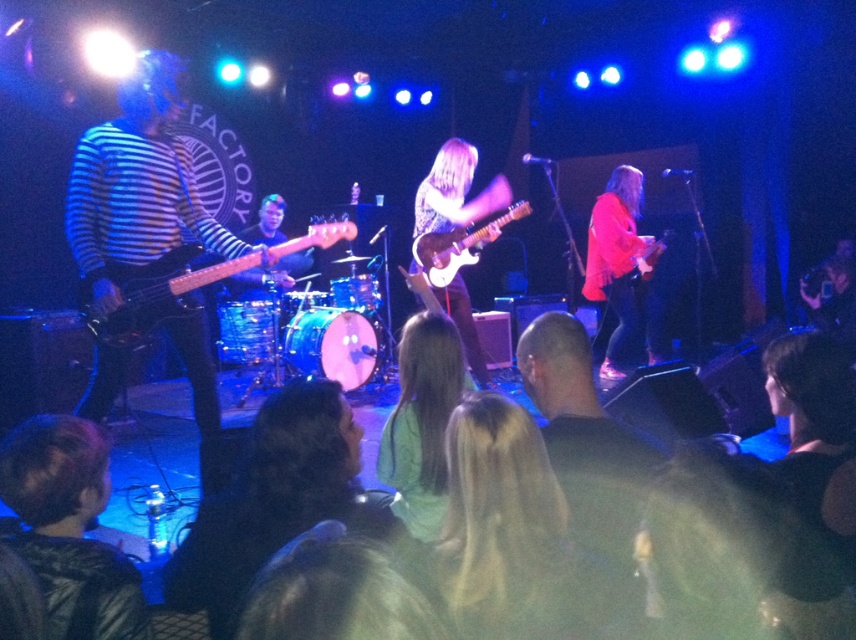
You are a photographer at The Factory venue. You want to take a photo of the two performers wearing the dark brown leather jacket at lower left and the light green fabric shirt at center. Which performer will appear larger in your photo?

The dark brown leather jacket at lower left is closer to the viewer than the light green fabric shirt at center, so the performer wearing the dark brown leather jacket at lower left will appear larger in the photo.

From the picture: You are a photographer at The Factory venue and need to set up a spotlight. You see the dark brown leather jacket at lower left and the matte pink sweater at right. Which one should you aim the spotlight at if you want to illuminate the taller object?

The matte pink sweater at right is taller than the dark brown leather jacket at lower left, so you should aim the spotlight at the matte pink sweater at right to illuminate the taller object.